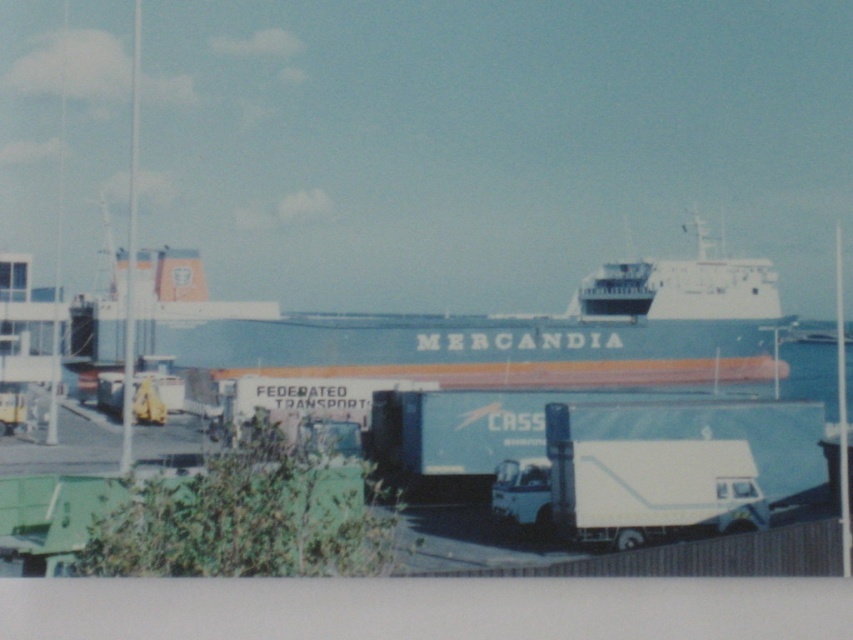
Question: Can you confirm if white matte ship at center is thinner than white matte trailer truck at center?

Choices:
 (A) yes
 (B) no

Answer: (B)

Question: Among these objects, which one is nearest to the camera?

Choices:
 (A) white matte trailer truck at center
 (B) white matte ship at center

Answer: (A)

Question: Is white matte ship at center smaller than white matte trailer truck at center?

Choices:
 (A) no
 (B) yes

Answer: (A)

Question: Is white matte ship at center wider than white matte trailer truck at center?

Choices:
 (A) no
 (B) yes

Answer: (B)

Question: Which point is farther from the camera taking this photo?

Choices:
 (A) (578, 508)
 (B) (740, 269)

Answer: (B)